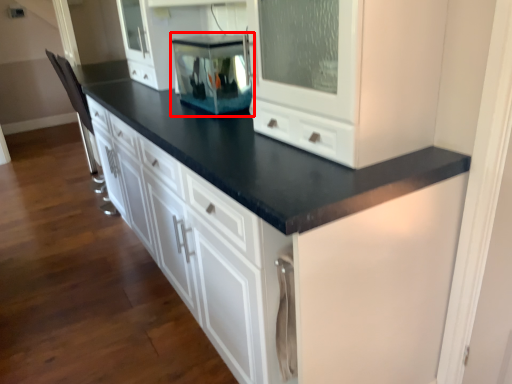
Question: From the image's perspective, what is the correct spatial relationship of appliance (annotated by the red box) in relation to cabinetry?

Choices:
 (A) above
 (B) below

Answer: (A)